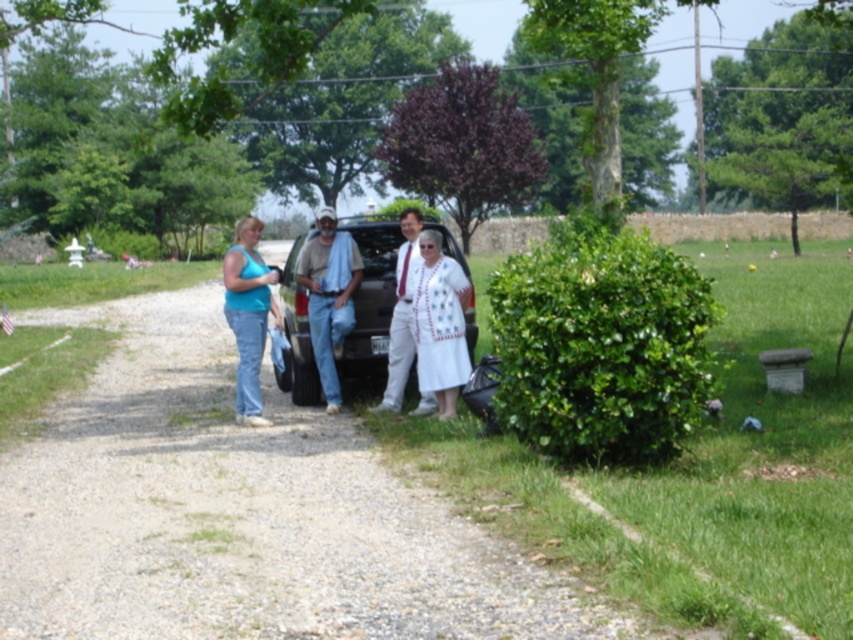
Question: Which point is farther from the camera taking this photo?

Choices:
 (A) (367, 314)
 (B) (355, 264)

Answer: (A)

Question: Is matte black suv at center smaller than matte blue tank top at center?

Choices:
 (A) yes
 (B) no

Answer: (B)

Question: Which point is closer to the camera?

Choices:
 (A) white lace dress at center
 (B) white cotton shirt at center

Answer: (A)

Question: From the image, what is the correct spatial relationship of gravel path at center in relation to denim jeans at center?

Choices:
 (A) below
 (B) above

Answer: (A)

Question: From the image, what is the correct spatial relationship of matte black suv at center in relation to matte blue tank top at center?

Choices:
 (A) below
 (B) above

Answer: (B)

Question: Which of the following is the closest to the observer?

Choices:
 (A) (381, 349)
 (B) (326, 321)
 (C) (242, 256)
 (D) (456, 396)

Answer: (C)